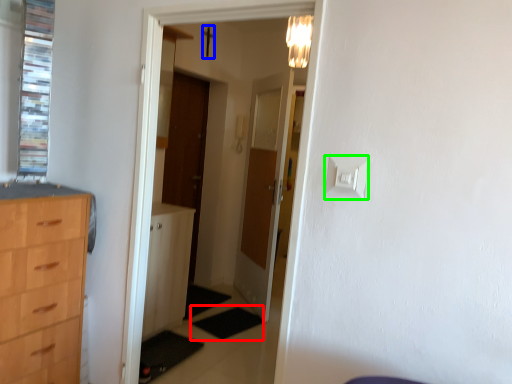
Question: Considering the real-world distances, which object is closest to mat (highlighted by a red box)? crucifix (highlighted by a blue box) or light switch (highlighted by a green box).

Choices:
 (A) crucifix
 (B) light switch

Answer: (B)